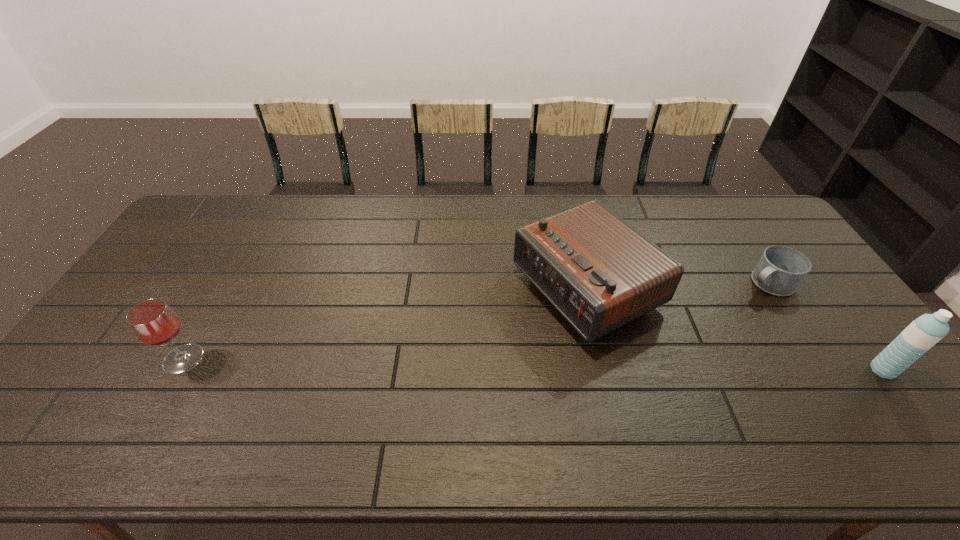
At what (x,y) coordinates should I click in order to perform the action: click on wineglass. Please return your answer as a coordinate pair (x, y). The height and width of the screenshot is (540, 960). Looking at the image, I should click on (153, 322).

Find the location of a particular element. water bottle is located at coordinates (924, 332).

In order to click on the shortest object in this screenshot , I will do `click(781, 269)`.

Identify the location of the third object from left to right. This screenshot has height=540, width=960. (781, 269).

Find the location of a particular element. radio receiver is located at coordinates pos(600,273).

The height and width of the screenshot is (540, 960). Find the location of `blank space located on the back of the leftmost object`. blank space located on the back of the leftmost object is located at coordinates (234, 269).

I want to click on free region located on the left of the water bottle, so click(x=820, y=370).

Locate an element on the screen. free space located on the side of the second object from right to left with the handle is located at coordinates (661, 340).

The image size is (960, 540). In order to click on free point located 0.400m on the side of the second object from right to left with the handle in this screenshot , I will do `click(654, 345)`.

Image resolution: width=960 pixels, height=540 pixels. I want to click on vacant space situated on the side of the second object from right to left with the handle, so click(x=684, y=327).